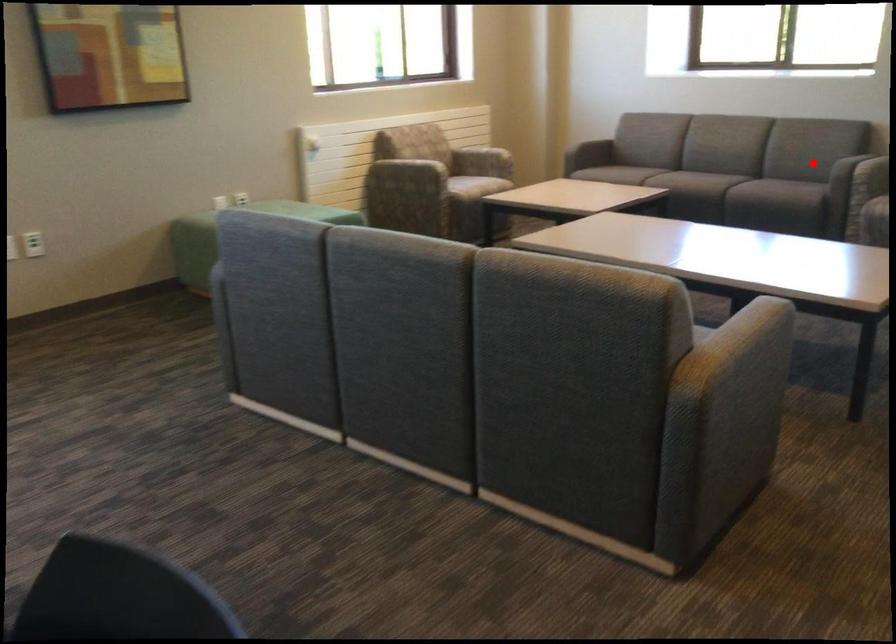
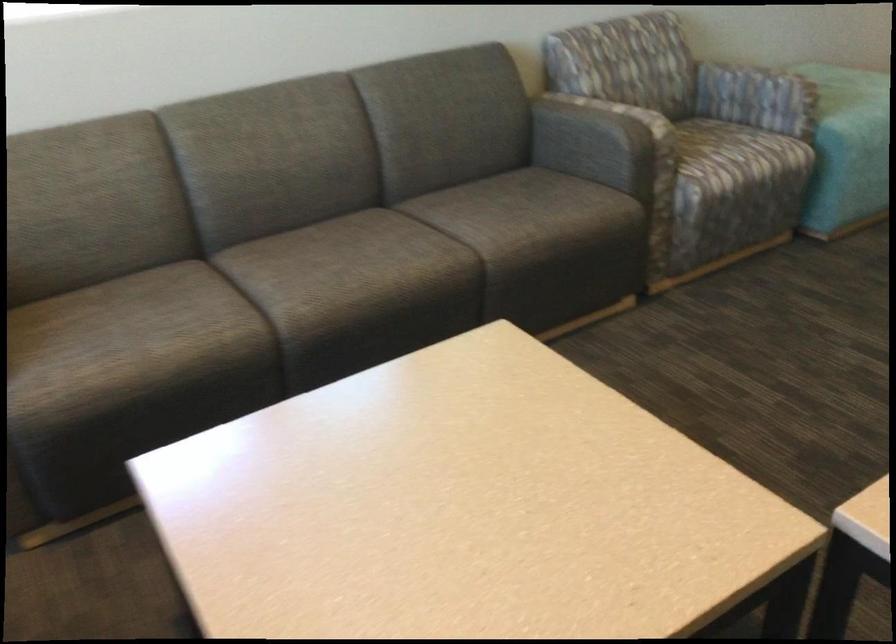
Question: I am providing you with two images of the same scene from different viewpoints. Given a red point in image1, look at the same physical point in image2. Is it:

Choices:
 (A) Closer to the viewpoint
 (B) Farther from the viewpoint

Answer: (A)